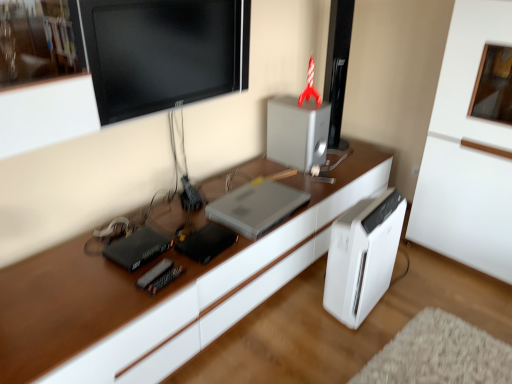
Identify the location of free space above satin silver speaker at upper center, the 2th appliance when ordered from bottom to top (from a real-world perspective). This screenshot has width=512, height=384. (306, 105).